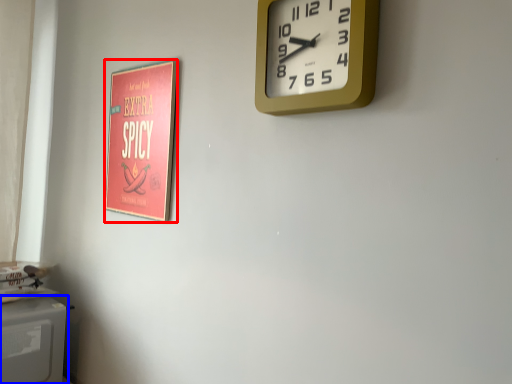
Question: Which object appears closest to the camera in this image, poster page (highlighted by a red box) or appliance (highlighted by a blue box)?

Choices:
 (A) poster page
 (B) appliance

Answer: (A)